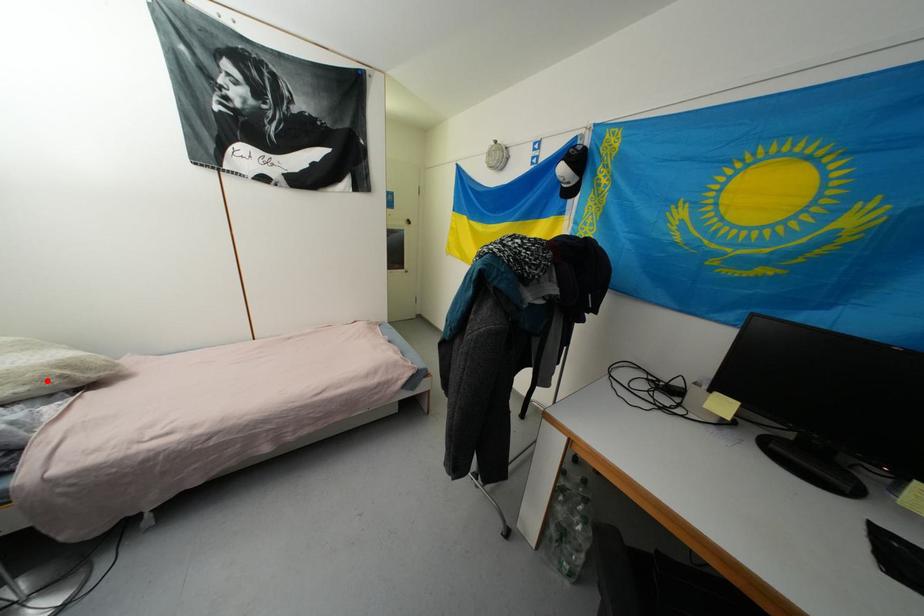
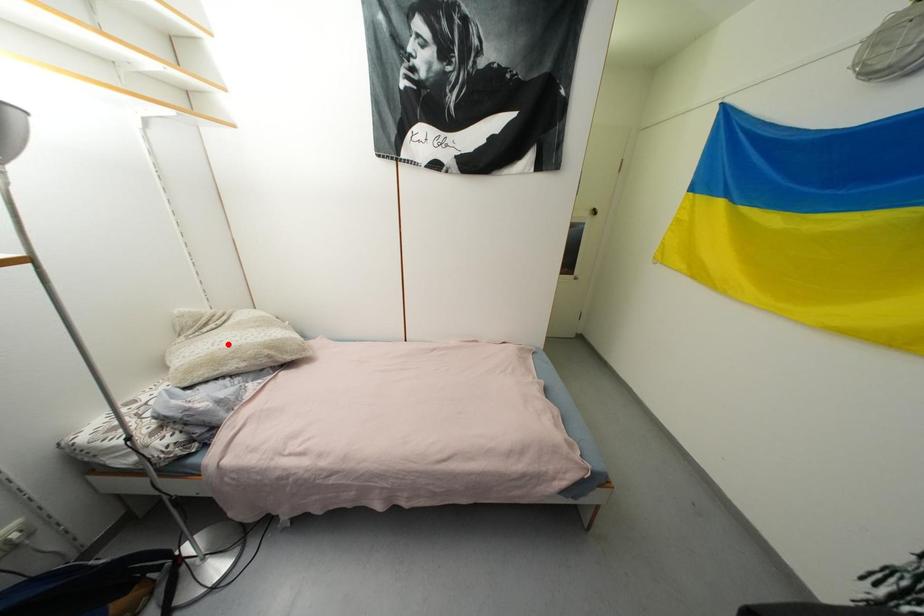
I am providing you with two images of the same scene from different viewpoints. A red point is marked on the first image and another point is marked on the second image. Are the points marked in image1 and image2 representing the same 3D position?

No